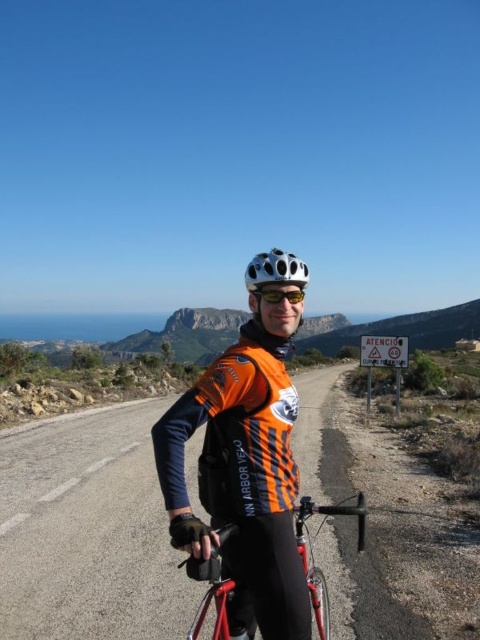
Does shiny red bicycle at center appear over white matte helmet at center?

Actually, shiny red bicycle at center is below white matte helmet at center.

Does point (358, 541) come closer to viewer compared to point (296, 291)?

No.

Between point (202, 576) and point (256, 259), which one is positioned behind?

The point (256, 259) is behind.

The height and width of the screenshot is (640, 480). I want to click on shiny red bicycle at center, so coord(312,554).

Where is `white matte helmet at center`? The width and height of the screenshot is (480, 640). white matte helmet at center is located at coordinates (276, 291).

Does white matte helmet at center appear over white matte bicycle helmet at center?

No.

Does point (272, 252) lie behind point (254, 284)?

Yes, point (272, 252) is behind point (254, 284).

This screenshot has width=480, height=640. What are the coordinates of `white matte helmet at center` in the screenshot? It's located at (276, 291).

Does point (348, 508) lie in front of point (287, 282)?

Yes, it is.

Does shiny red bicycle at center appear on the left side of white matte bicycle helmet at center?

Correct, you'll find shiny red bicycle at center to the left of white matte bicycle helmet at center.

Measure the distance between point (305, 573) and camera.

They are 2.75 meters apart.

This screenshot has height=640, width=480. Find the location of `shiny red bicycle at center`. shiny red bicycle at center is located at coordinates (312, 554).